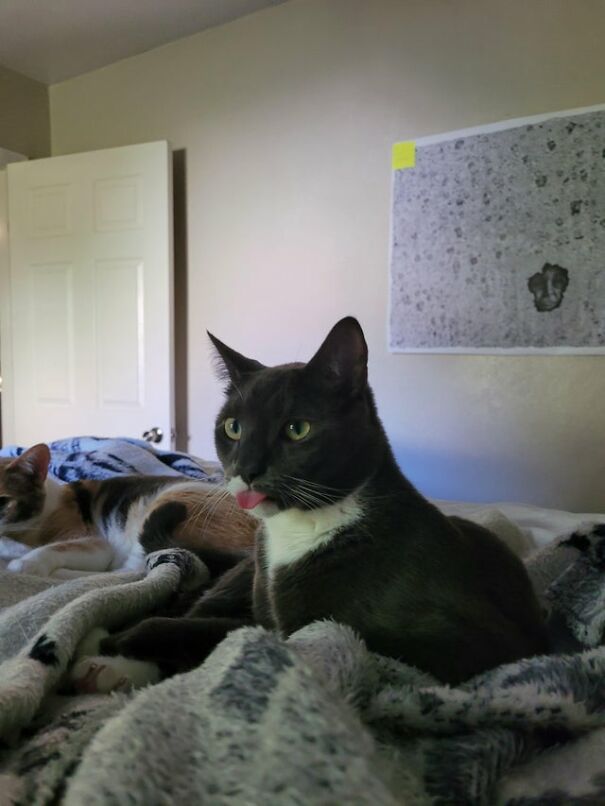
At what (x,y) coordinates should I click in order to perform the action: click on white fur. Please return your answer as a coordinate pair (x, y). This screenshot has height=806, width=605. Looking at the image, I should click on (281, 539).